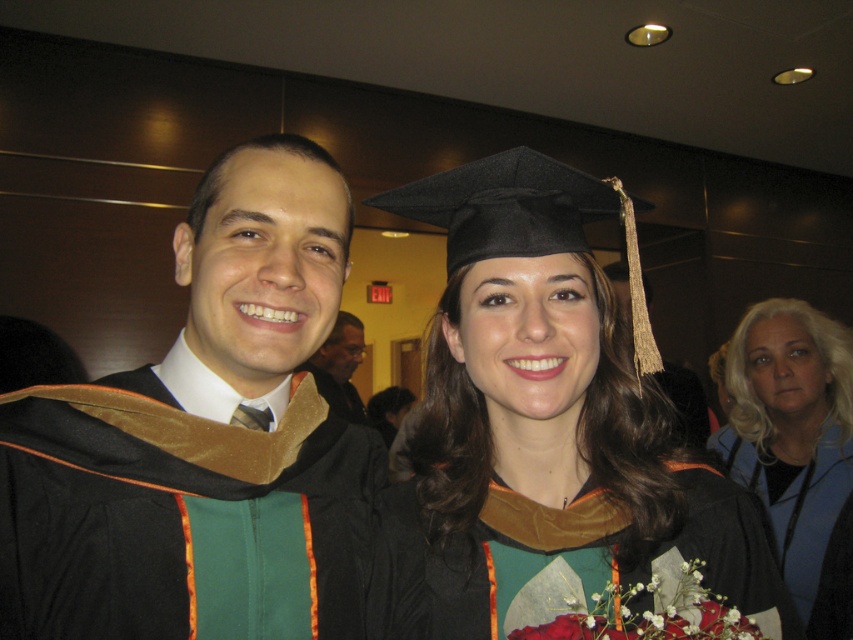
You are a photographer at the graduation ceremony. You need to frame a closeup shot of both the matte black graduation cap at center and the matte black graduation gown at center. Given their sizes, which one should you focus on to ensure both fit in the frame without cropping?

The matte black graduation cap at center is wider than the matte black graduation gown at center. To ensure both fit in the frame without cropping, focus on the wider object, which is the matte black graduation cap at center, as it requires more space.

You are a photographer at the graduation ceremony. You want to take a photo that focuses on the blonde hair at upper right and the matte black graduation gown at center. Which object should you zoom in on to make it appear bigger in the photo?

The blonde hair at upper right has a larger size compared to the matte black graduation gown at center, so you should zoom in on the blonde hair at upper right to make it appear bigger in the photo.